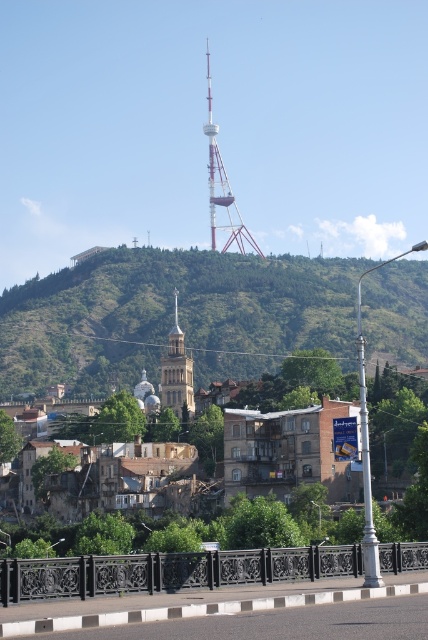
How distant is green leafy hillside at upper center from golden stone church at center?

green leafy hillside at upper center and golden stone church at center are 58.47 meters apart from each other.

Which is more to the right, green leafy hillside at upper center or golden stone church at center?

golden stone church at center

Who is more distant from viewer, (395, 321) or (175, 288)?

The point (175, 288) is behind.

Where is `green leafy hillside at upper center`? green leafy hillside at upper center is located at coordinates (172, 316).

Is the position of metallic lattice tower at center less distant than that of golden stone church at center?

No, it is behind golden stone church at center.

Does metallic lattice tower at center have a greater width compared to golden stone church at center?

Yes.

Which is behind, point (207, 51) or point (177, 326)?

Point (207, 51)

Locate an element on the screen. metallic lattice tower at center is located at coordinates (222, 186).

Does point (26, 308) lie behind point (211, 241)?

No, it is not.

Does green leafy hillside at upper center have a greater width compared to metallic lattice tower at center?

Yes, green leafy hillside at upper center is wider than metallic lattice tower at center.

Is point (345, 266) positioned behind point (241, 221)?

No.

Locate an element on the screen. green leafy hillside at upper center is located at coordinates (172, 316).